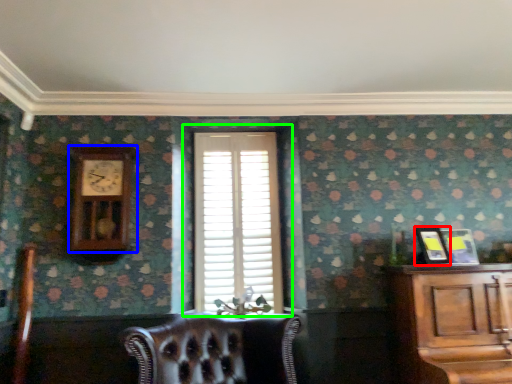
Question: Estimate the real-world distances between objects in this image. Which object is closer to picture frame (highlighted by a red box), clock (highlighted by a blue box) or window (highlighted by a green box)?

Choices:
 (A) clock
 (B) window

Answer: (B)